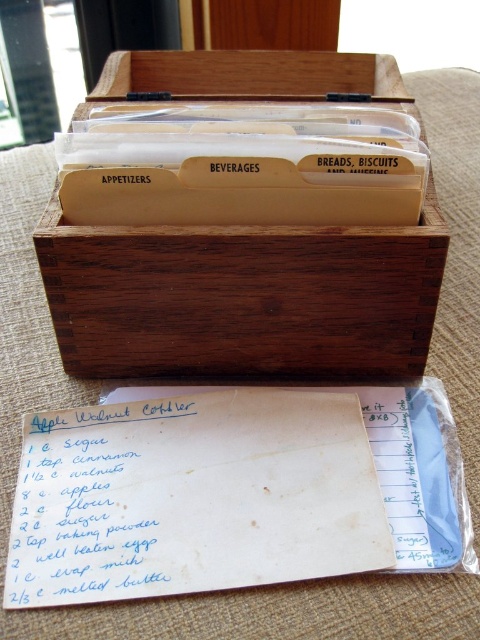
You are organizing your kitchen and have a wooden box at center and a white handwritten paper at center. Which object is wider?

The wooden box at center is wider than the white handwritten paper at center.

In the scene shown: You are looking at the wooden box and the handwritten recipe card. Which of the two points, point (x=156, y=241) or point (x=192, y=513), is closer to you?

Point (x=156, y=241) is closer to you because it is further to the viewer than point (x=192, y=513).

You are a chef who wants to place the white handwritten paper at center into the wooden box at center. Can you fit it in without folding?

The wooden box at center and white handwritten paper at center are 11.30 inches apart from each other. Since the distance between them is 11.30 inches, the paper can be moved into the box without folding as there is enough space between them.